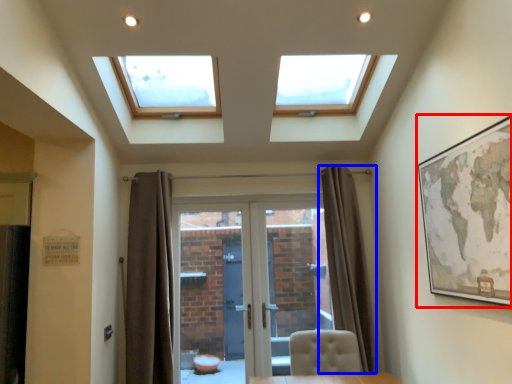
Question: Which object appears closest to the camera in this image, picture frame (highlighted by a red box) or curtain (highlighted by a blue box)?

Choices:
 (A) picture frame
 (B) curtain

Answer: (A)